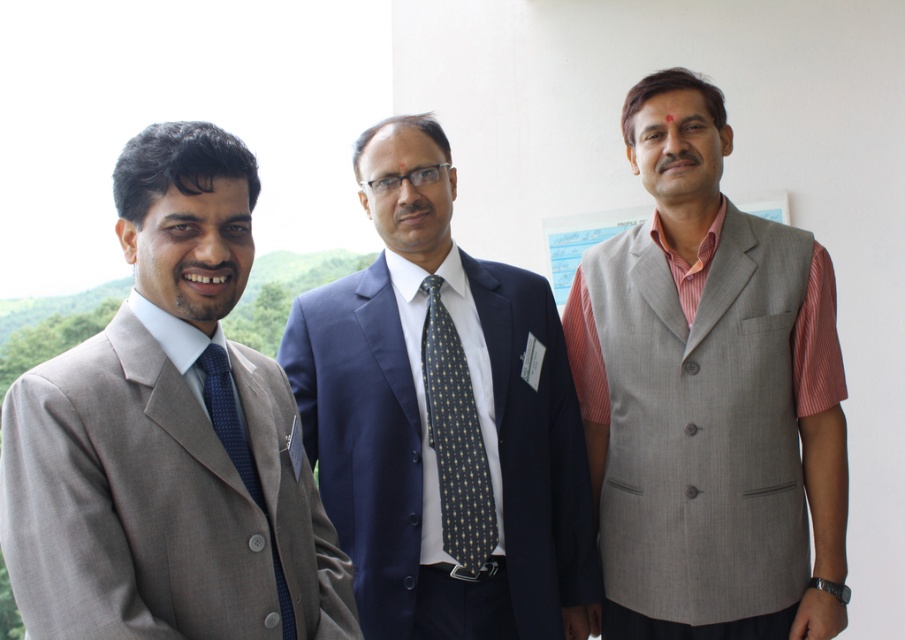
Does dark blue textured tie at center lie in front of blue paper at center?

Yes, dark blue textured tie at center is closer to the viewer.

This screenshot has width=905, height=640. In order to click on dark blue textured tie at center in this screenshot , I will do `click(455, 440)`.

You are a GUI agent. You are given a task and a screenshot of the screen. Output one action in this format:
    pyautogui.click(x=<x>, y=<y>)
    Task: Click on the dark blue textured tie at center
    
    Given the screenshot: What is the action you would take?
    pyautogui.click(x=455, y=440)

Between light gray woolen vest at right and matte blue suit at center, which one appears on the left side from the viewer's perspective?

From the viewer's perspective, matte blue suit at center appears more on the left side.

Is light gray woolen vest at right closer to camera compared to matte blue suit at center?

That is False.

This screenshot has height=640, width=905. What do you see at coordinates (710, 397) in the screenshot? I see `light gray woolen vest at right` at bounding box center [710, 397].

Identify the location of light gray woolen vest at right. (710, 397).

How distant is matte gray suit at left from matte blue suit at center?

matte gray suit at left and matte blue suit at center are 24.24 inches apart.

Is matte gray suit at left smaller than matte blue suit at center?

Indeed, matte gray suit at left has a smaller size compared to matte blue suit at center.

Is point (221, 252) positioned after point (567, 628)?

No, (221, 252) is in front of (567, 628).

In order to click on matte gray suit at left in this screenshot , I will do `click(169, 436)`.